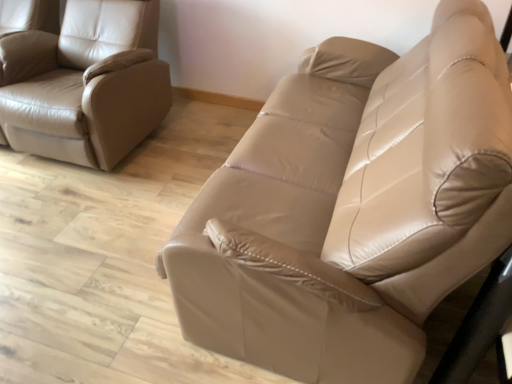
Where is `vacant point to the left of matte leather couch at center`? The image size is (512, 384). vacant point to the left of matte leather couch at center is located at coordinates (109, 237).